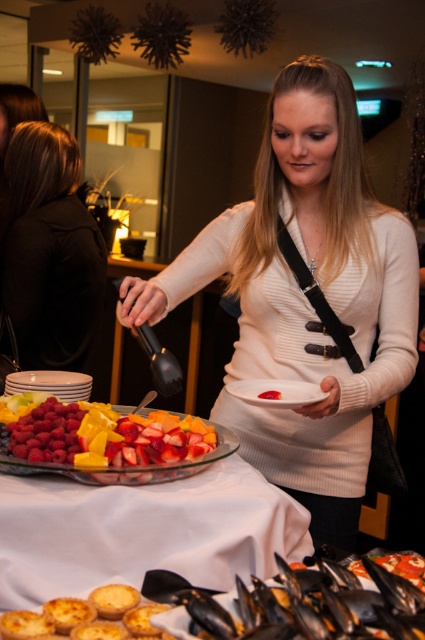
Between point (73, 369) and point (244, 392), which one is positioned behind?

The point (73, 369) is behind.

Locate an element on the screen. This screenshot has width=425, height=640. black fabric hair at left is located at coordinates (48, 250).

Is point (217, 480) closer to camera compared to point (130, 609)?

No, (217, 480) is behind (130, 609).

This screenshot has height=640, width=425. Find the location of `translucent glass bowl of fruit at center`. translucent glass bowl of fruit at center is located at coordinates (144, 529).

Is point (238, 483) closer to viewer compared to point (53, 602)?

No, (238, 483) is behind (53, 602).

I want to click on translucent glass bowl of fruit at center, so click(x=144, y=529).

Does white matte sweater at center have a larger size compared to translucent glass bowl of fruit at center?

Indeed, white matte sweater at center has a larger size compared to translucent glass bowl of fruit at center.

Is point (350, 502) in front of point (297, 560)?

No, it is behind (297, 560).

What do you see at coordinates (305, 296) in the screenshot? I see `white matte sweater at center` at bounding box center [305, 296].

At what (x,y) coordinates should I click in order to perform the action: click on white matte sweater at center. Please return your answer as a coordinate pair (x, y). This screenshot has width=425, height=640. Looking at the image, I should click on pyautogui.click(x=305, y=296).